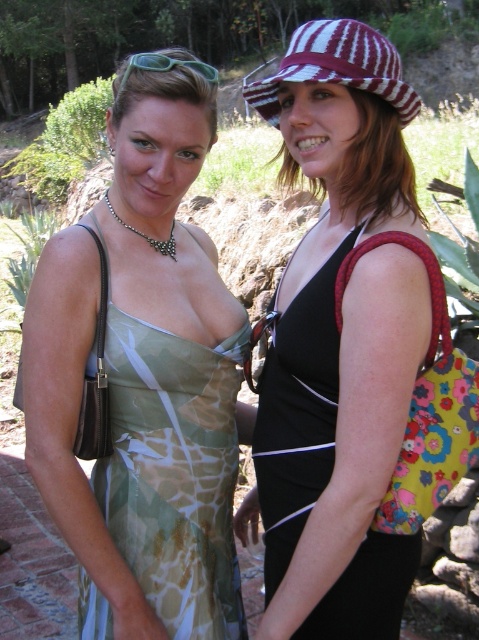
Question: Which point is closer to the camera?

Choices:
 (A) (272, 99)
 (B) (136, 138)
 (C) (356, 349)

Answer: (C)

Question: Based on their relative distances, which object is nearer to the printed fabric dress at left?

Choices:
 (A) black matte dress at center
 (B) maroon and white striped fabric hat at upper right

Answer: (A)

Question: Does printed fabric dress at left appear on the left side of maroon and white striped fabric hat at upper right?

Choices:
 (A) yes
 (B) no

Answer: (A)

Question: Where is printed fabric dress at left located in relation to black matte dress at center in the image?

Choices:
 (A) above
 (B) below

Answer: (B)

Question: Which of the following is the farthest from the observer?

Choices:
 (A) (364, 67)
 (B) (152, 477)
 (C) (330, 38)

Answer: (B)

Question: Is printed fabric dress at left above maroon and white striped fabric hat at upper right?

Choices:
 (A) no
 (B) yes

Answer: (A)